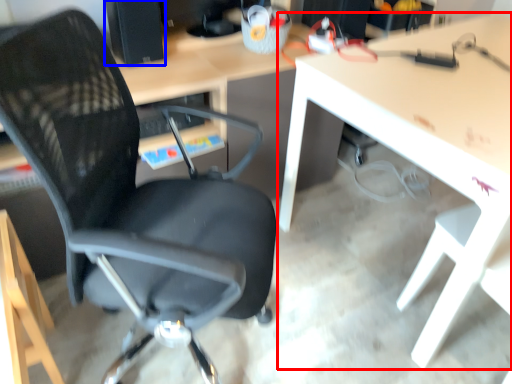
Question: Which of the following is the closest to the observer, table (highlighted by a red box) or desktop computer (highlighted by a blue box)?

Choices:
 (A) table
 (B) desktop computer

Answer: (A)